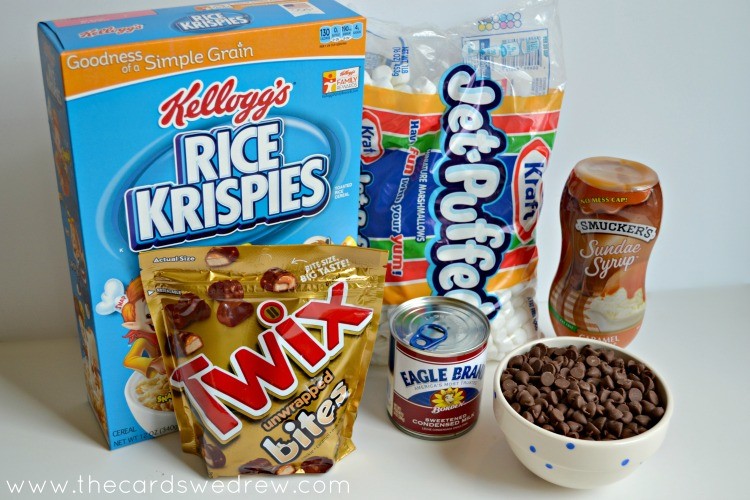
Find the location of a particular element. Image resolution: width=750 pixels, height=500 pixels. surface is located at coordinates (702, 484).